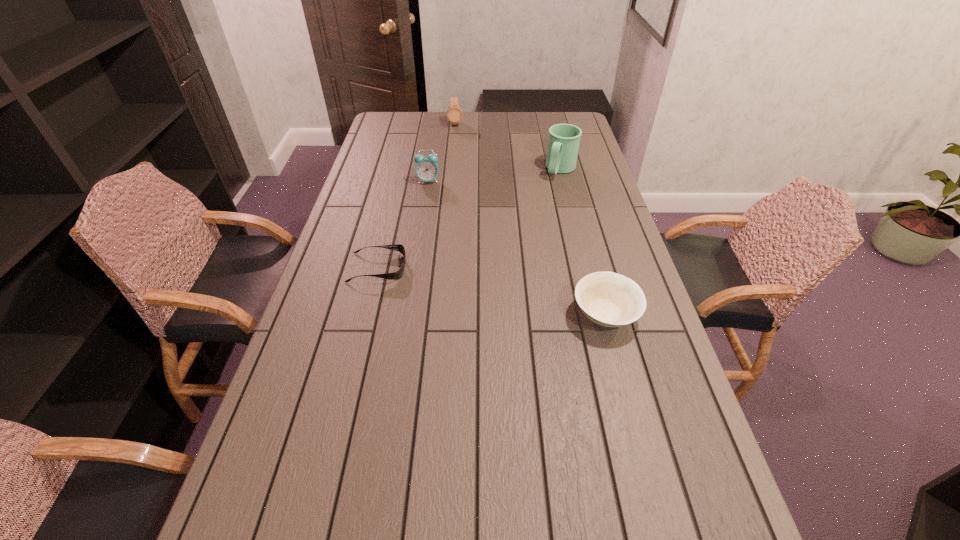
This screenshot has width=960, height=540. Find the location of `object situated at the left edge`. object situated at the left edge is located at coordinates (397, 275).

You are a GUI agent. You are given a task and a screenshot of the screen. Output one action in this format:
    pyautogui.click(x=<x>, y=<y>)
    Task: Click on the bowl that is at the right edge
    
    Given the screenshot: What is the action you would take?
    pyautogui.click(x=609, y=299)

The height and width of the screenshot is (540, 960). I want to click on mug that is positioned at the right edge, so click(563, 143).

What are the coordinates of `vacant space at the far edge of the desktop` in the screenshot? It's located at (513, 125).

The image size is (960, 540). Find the location of `vacant position at the near edge of the desktop`. vacant position at the near edge of the desktop is located at coordinates (399, 473).

This screenshot has height=540, width=960. Find the location of `vacant space at the left edge of the desktop`. vacant space at the left edge of the desktop is located at coordinates (375, 171).

The width and height of the screenshot is (960, 540). I want to click on free point at the right edge, so click(x=600, y=340).

Where is `free point at the far left corner`? This screenshot has height=540, width=960. free point at the far left corner is located at coordinates (409, 118).

The image size is (960, 540). In order to click on vacant region between the alarm clock and the third object from left to right in this screenshot , I will do `click(442, 152)`.

At what (x,y) coordinates should I click in order to perform the action: click on vacant space in between the shortest object and the bowl. Please return your answer as a coordinate pair (x, y). The image size is (960, 540). Looking at the image, I should click on (492, 291).